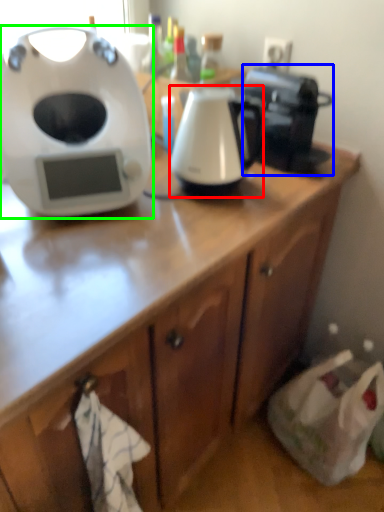
Question: Considering the real-world distances, which object is farthest from kitchen appliance (highlighted by a red box)? coffee maker (highlighted by a blue box) or home appliance (highlighted by a green box)?

Choices:
 (A) coffee maker
 (B) home appliance

Answer: (B)